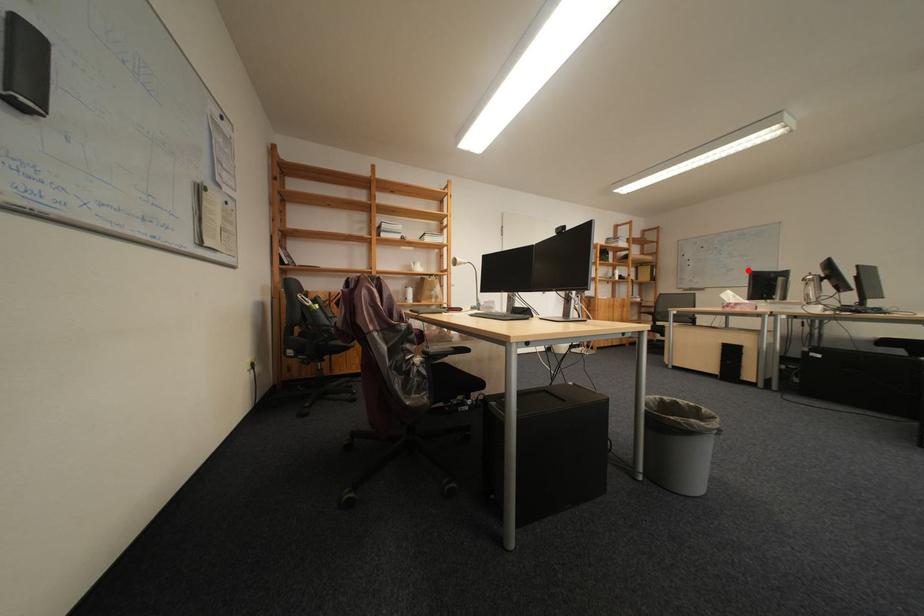
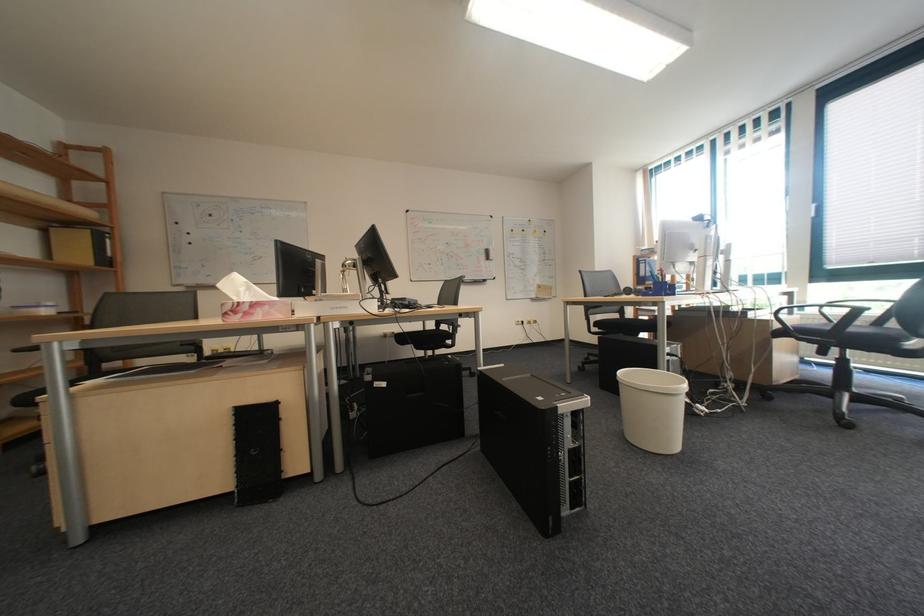
Question: A red point is marked in image1. In image2, is the corresponding 3D point closer to the camera or farther? Reply with the corresponding letter.

Choices:
 (A) The corresponding 3D point is closer.
 (B) The corresponding 3D point is farther.

Answer: (A)